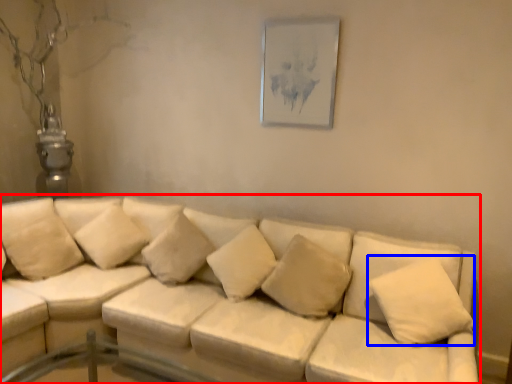
Question: Which object is further to the camera taking this photo, studio couch (highlighted by a red box) or pillow (highlighted by a blue box)?

Choices:
 (A) studio couch
 (B) pillow

Answer: (B)